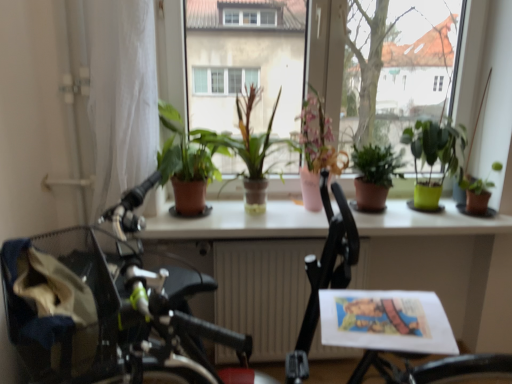
Question: From a real-world perspective, is green plastic pot at right, the fifth houseplant positioned from the left, positioned above or below white glossy table at center?

Choices:
 (A) below
 (B) above

Answer: (B)

Question: Is green plastic pot at right, the fifth houseplant positioned from the left, taller or shorter than white glossy table at center?

Choices:
 (A) tall
 (B) short

Answer: (B)

Question: Based on their relative distances, which object is farther from the white glossy window sill at center?

Choices:
 (A) green matte plant at center, marked as the 3th houseplant in a right-to-left arrangement
 (B) green matte plant at center, placed as the 1th houseplant when sorted from left to right
 (C) green matte plant at center, which is counted as the 5th houseplant, starting from the right
 (D) green plastic pot at right, the fifth houseplant positioned from the left
 (E) pink ceramic vase at center, which is counted as the 4th houseplant, starting from the right

Answer: (D)

Question: Estimate the real-world distances between objects in this image. Which object is farther from the pink ceramic vase at center, which is counted as the third houseplant, starting from the left?

Choices:
 (A) green matte plant at center, the fourth houseplant viewed from the left
 (B) green plastic pot at right, the fifth houseplant positioned from the left
 (C) white glossy table at center
 (D) green matte plant at center, placed as the 1th houseplant when sorted from left to right
 (E) white glossy window sill at center

Answer: (D)